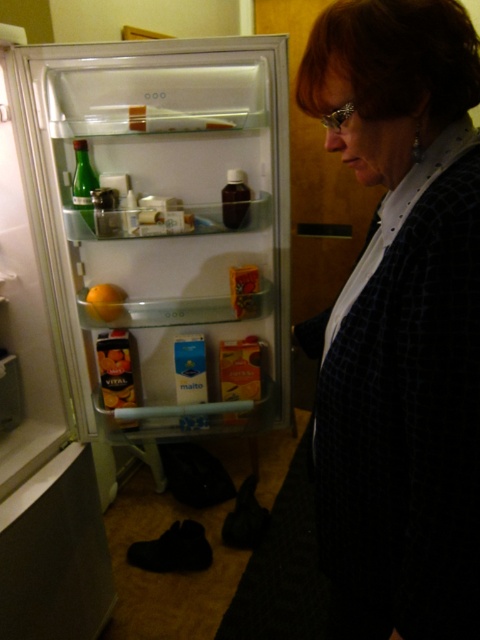
Question: Is dark blue textured sweater at center right bigger than orange matte at left?

Choices:
 (A) yes
 (B) no

Answer: (A)

Question: Which point is closer to the camera?

Choices:
 (A) dark blue textured sweater at center right
 (B) clear glass refrigerator at center
 (C) orange matte at left

Answer: (A)

Question: Which of the following is the farthest from the observer?

Choices:
 (A) clear glass refrigerator at center
 (B) orange matte at left

Answer: (B)

Question: In this image, where is clear glass refrigerator at center located relative to dark blue textured sweater at center right?

Choices:
 (A) above
 (B) below

Answer: (A)

Question: Considering the real-world distances, which object is farthest from the clear glass refrigerator at center?

Choices:
 (A) dark blue textured sweater at center right
 (B) orange matte at left

Answer: (A)

Question: Is the position of clear glass refrigerator at center more distant than that of dark blue textured sweater at center right?

Choices:
 (A) no
 (B) yes

Answer: (B)